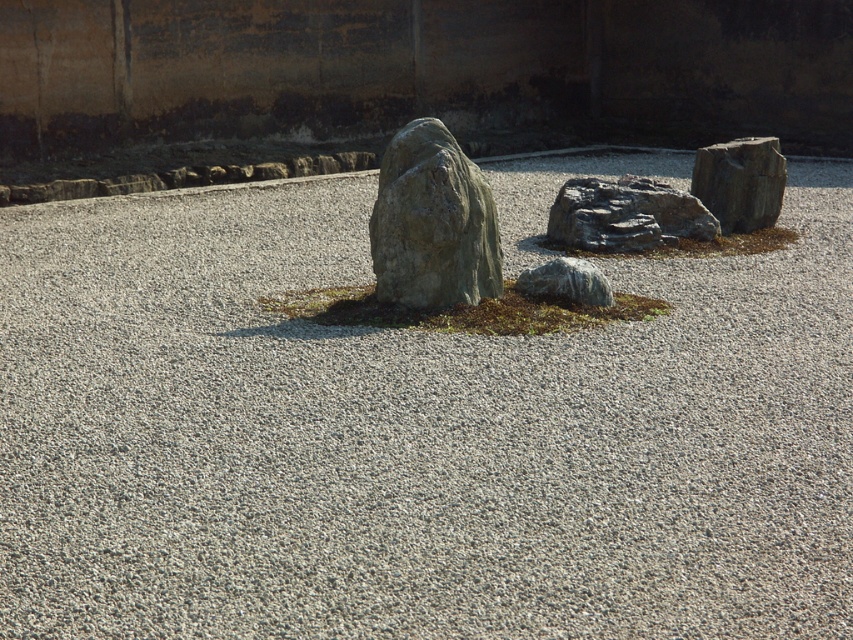
Does rough gray rock at center have a greater height compared to gray rough rock at center?

Yes.

Between point (575, 220) and point (585, 285), which one is positioned in front?

Point (585, 285) is more forward.

What are the coordinates of `rough gray rock at center` in the screenshot? It's located at (625, 214).

Does smooth gray rock at right come behind gray rough rock at center?

That is True.

Between smooth gray rock at right and gray rough rock at center, which one has more height?

Standing taller between the two is smooth gray rock at right.

The height and width of the screenshot is (640, 853). I want to click on smooth gray rock at right, so click(740, 182).

Can you confirm if gray rough stone at center is bigger than smooth gray rock at right?

No, gray rough stone at center is not bigger than smooth gray rock at right.

Where is `gray rough stone at center`? gray rough stone at center is located at coordinates (432, 221).